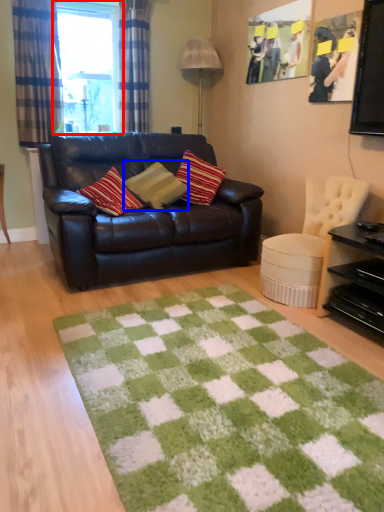
Question: Which object appears farthest to the camera in this image, window (highlighted by a red box) or pillow (highlighted by a blue box)?

Choices:
 (A) window
 (B) pillow

Answer: (A)